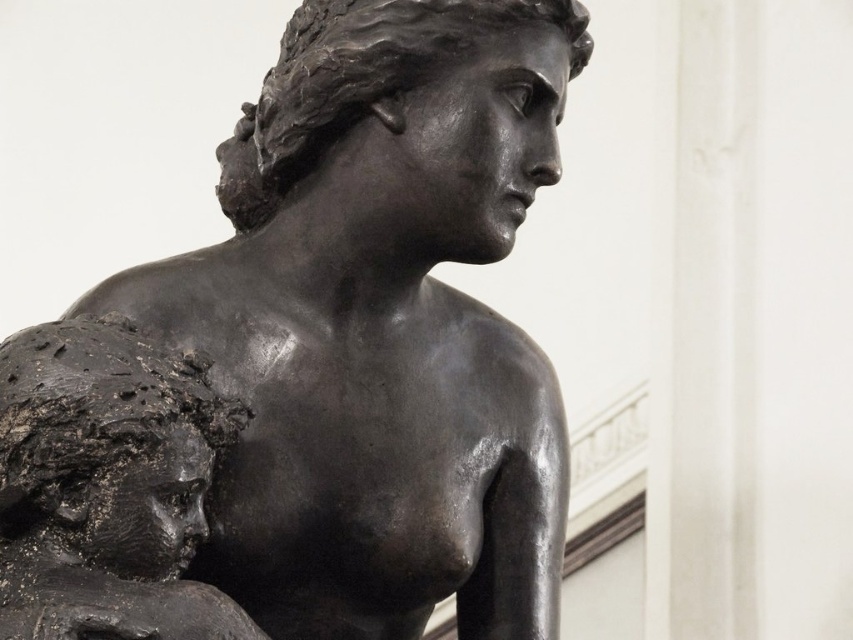
You are an art curator arranging a gallery layout. You have two matte black sculptures in front of you. Based on the scene, where should the matte black bust at left be placed relative to the matte black statue at center to maintain the original composition?

The matte black statue at center should be placed to the right of the matte black bust at left, so the matte black bust at left is on the left side and the matte black statue at center is on the right side to match the original arrangement.

Consider the image. You are an art conservator examining the matte black statue at center. Based on its position coordinates, can you determine if it is positioned closer to the top or bottom of the image?

The matte black statue at center is located at point coordinates with a y value of 0.368, which places it closer to the bottom of the image since lower y values indicate lower positions.

You are an art curator planning to display both the matte black statue at center and the matte black bust at left in a gallery. Given their sizes, which object should be placed on the wider shelf to accommodate its dimensions?

The matte black statue at center should be placed on the wider shelf because its width is larger than the matte black bust at left.